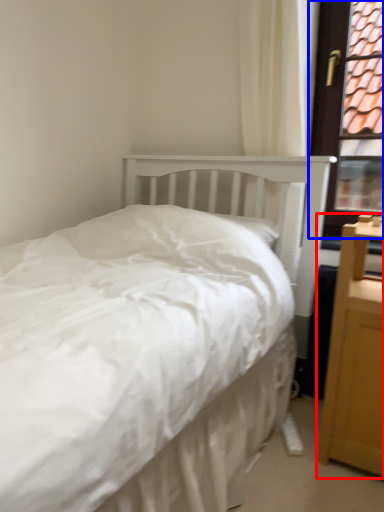
Question: Among these objects, which one is nearest to the camera, nightstand (highlighted by a red box) or window frame (highlighted by a blue box)?

Choices:
 (A) nightstand
 (B) window frame

Answer: (A)